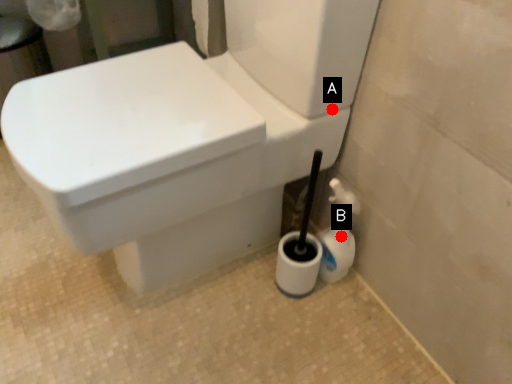
Question: Two points are circled on the image, labeled by A and B beside each circle. Which point is further to the camera?

Choices:
 (A) A is further
 (B) B is further

Answer: (B)